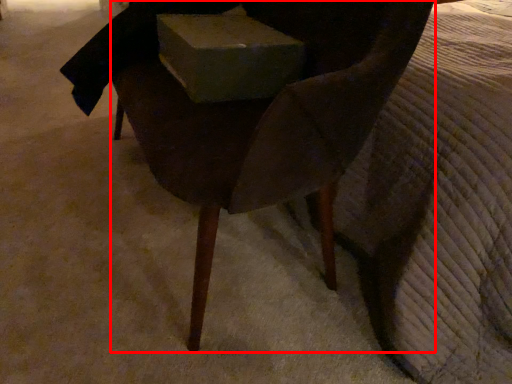
Question: From the image's perspective, where is chair (annotated by the red box) located relative to box?

Choices:
 (A) above
 (B) below

Answer: (B)